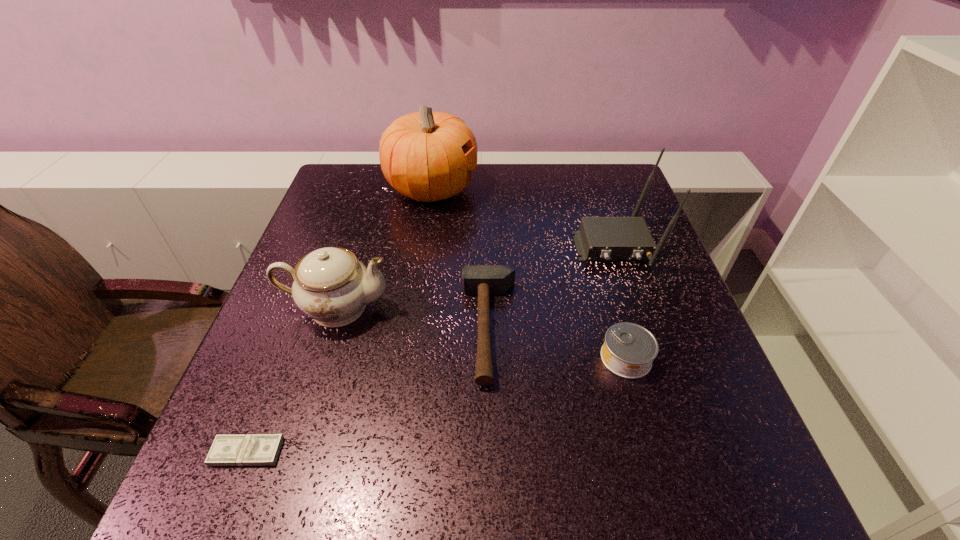
You are a GUI agent. You are given a task and a screenshot of the screen. Output one action in this format:
    pyautogui.click(x=<x>, y=<y>)
    Task: Click on the free location that satisfies the following two spatial constraints: 1. on the striking surface of the can; 2. on the right side of the hammer
    
    Given the screenshot: What is the action you would take?
    pyautogui.click(x=490, y=358)

Locate an element on the screen. The height and width of the screenshot is (540, 960). vacant space that satisfies the following two spatial constraints: 1. on the back of the fifth nearest object to connect cables; 2. on the striking surface of the hammer is located at coordinates coord(642,328).